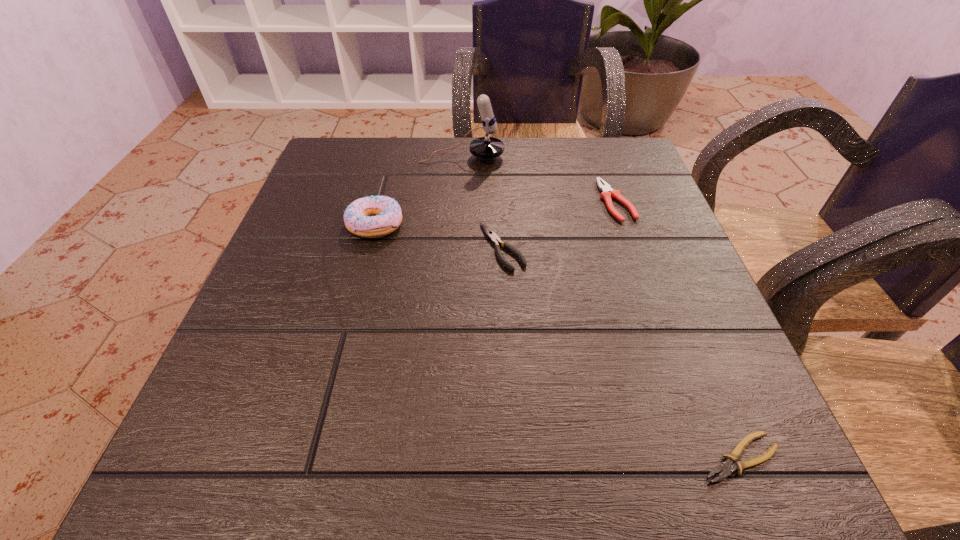
Image resolution: width=960 pixels, height=540 pixels. I want to click on the farthest object, so click(x=486, y=147).

Find the location of a particular element. Image resolution: width=960 pixels, height=540 pixels. the tallest object is located at coordinates (486, 147).

You are a GUI agent. You are given a task and a screenshot of the screen. Output one action in this format:
    pyautogui.click(x=<x>, y=<y>)
    Task: Click on the second tallest object
    The height and width of the screenshot is (540, 960).
    Given the screenshot: What is the action you would take?
    pyautogui.click(x=357, y=219)

Where is `doughnut`? doughnut is located at coordinates (357, 219).

Find the location of a particular element. the farthest pliers is located at coordinates (607, 192).

Where is `the second farthest pliers`? The image size is (960, 540). the second farthest pliers is located at coordinates (491, 235).

The width and height of the screenshot is (960, 540). In order to click on the nearest pliers in this screenshot , I will do `click(726, 467)`.

Locate an element on the screen. Image resolution: width=960 pixels, height=540 pixels. the nearest object is located at coordinates (726, 467).

I want to click on blank space located on the front of the tallest object, so click(456, 260).

Identify the location of vacant space situated on the front of the leftmost object. (361, 280).